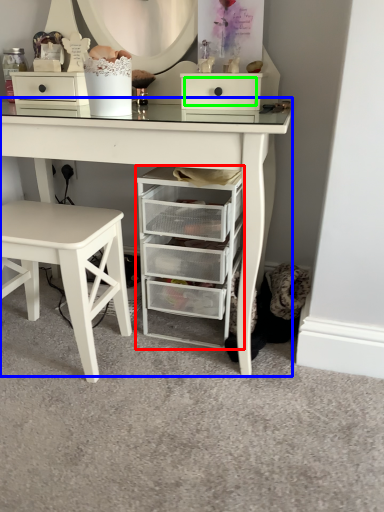
Question: Based on their relative distances, which object is nearer to chest of drawers (highlighted by a red box)? Choose from table (highlighted by a blue box) and drawer (highlighted by a green box).

Choices:
 (A) table
 (B) drawer

Answer: (A)